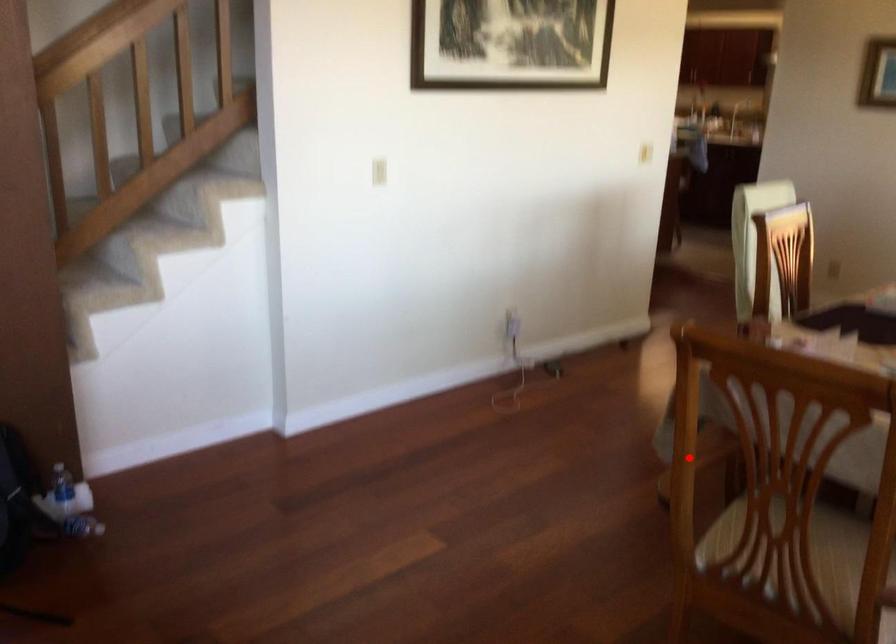
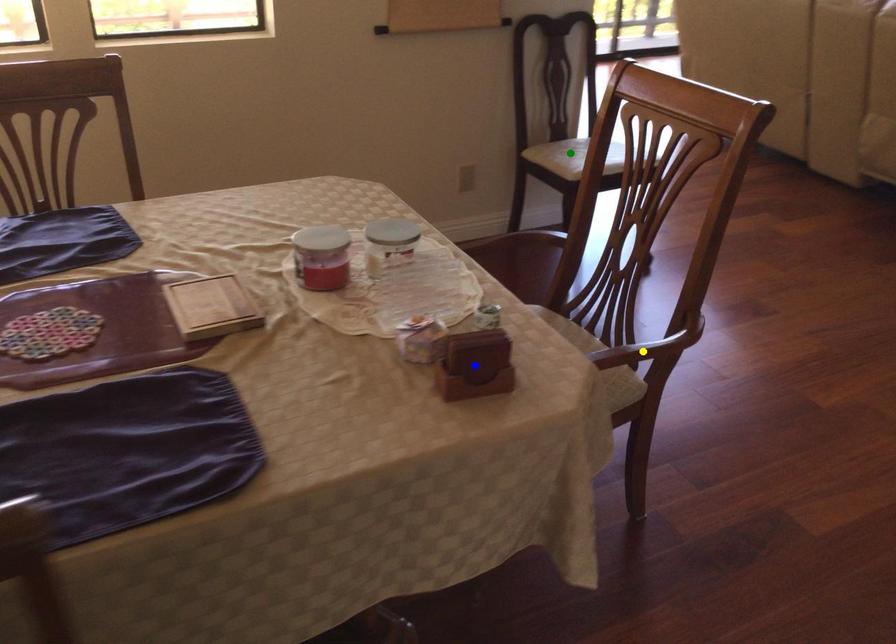
Question: I am providing you with two images of the same scene from different viewpoints. A red point is marked on the first image. You are given multiple points on the second image. Which point in image 2 represents the same 3d spot as the red point in image 1?

Choices:
 (A) yellow point
 (B) blue point
 (C) green point

Answer: (A)